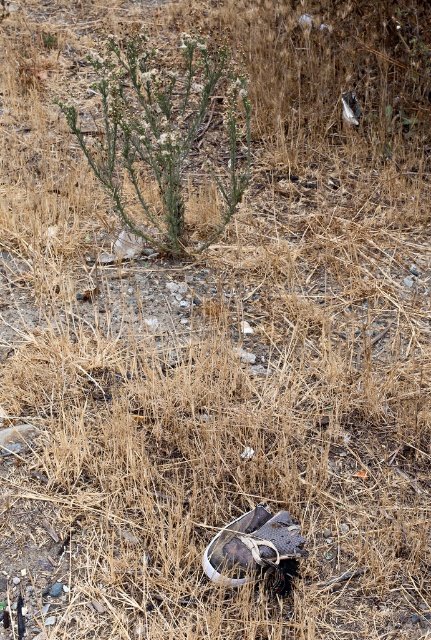
You are a botanist studying plant growth patterns in arid environments. You observe the green leafy plant at center in the image. Based on its coordinates, can you determine its location relative to the center of the image?

The green leafy plant at center is located at coordinates point (162, 134), which places it slightly to the left and above the center of the image.

You are a gardener trying to plant a new shrub in the center of the scene. There is a green leafy plant at center and a white leather shoe at center. Which object should you move to make space?

You should move the white leather shoe at center because the green leafy plant at center might be wider and needs more space to grow properly.